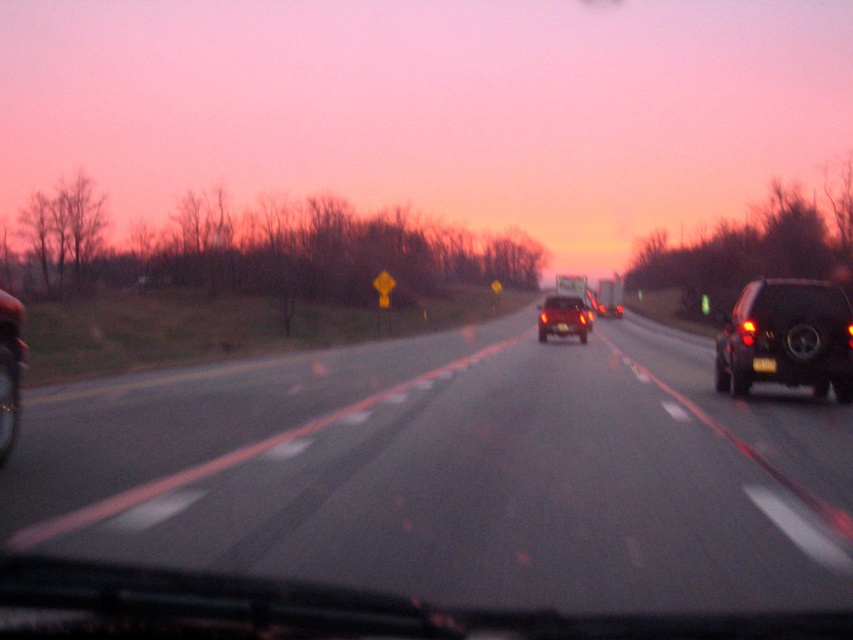
You are a passenger in the car and want to point out an object in the image. You see a point at coordinates (561, 317). What object is this point on?

The point at coordinates (561, 317) is on the matte black car at center.

You are driving a car and see two points on the road ahead. The first point is at coordinate point(759,360) and the second is at point(561,330). Which point is closer to your current position?

Point(561,330) is closer to your current position because it is behind point(759,360), which is in front of it.

You are standing on the side of the highway and see the matte black car at center approaching you. If your reaction time is 1 second, and the car is moving at 60 km per hour, will you have enough time to safely step back 5 meters to avoid it?

The matte black car at center is 40.61 meters away from you. Converting 60 km per hour to meters per second gives approximately 16.67 m per second. In 1 second, the car will travel about 16.67 meters, leaving 23.94 meters between you and the car. Since you only need to step back 5 meters, you have sufficient time to avoid the car safely.